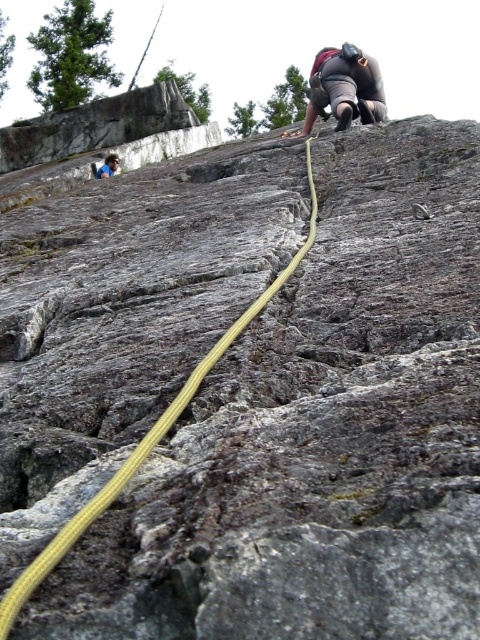
Question: Which of the following is the closest to the observer?

Choices:
 (A) yellow braided rope at center
 (B) matte black harness at upper center

Answer: (A)

Question: Is yellow braided rope at center thinner than matte black harness at upper center?

Choices:
 (A) yes
 (B) no

Answer: (A)

Question: Which object is the closest to the yellow braided rope at center?

Choices:
 (A) blue fabric shirt at upper left
 (B) matte black harness at upper center

Answer: (B)

Question: Can you confirm if yellow braided rope at center is positioned below matte black harness at upper center?

Choices:
 (A) no
 (B) yes

Answer: (B)

Question: Can you confirm if matte black harness at upper center is positioned above blue fabric shirt at upper left?

Choices:
 (A) yes
 (B) no

Answer: (A)

Question: Estimate the real-world distances between objects in this image. Which object is closer to the yellow braided rope at center?

Choices:
 (A) matte black harness at upper center
 (B) blue fabric shirt at upper left

Answer: (A)